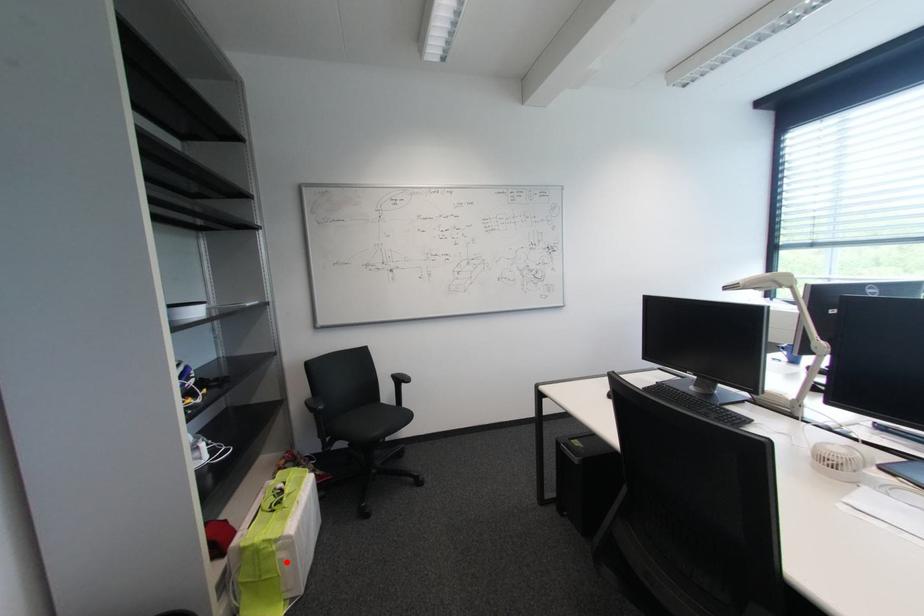
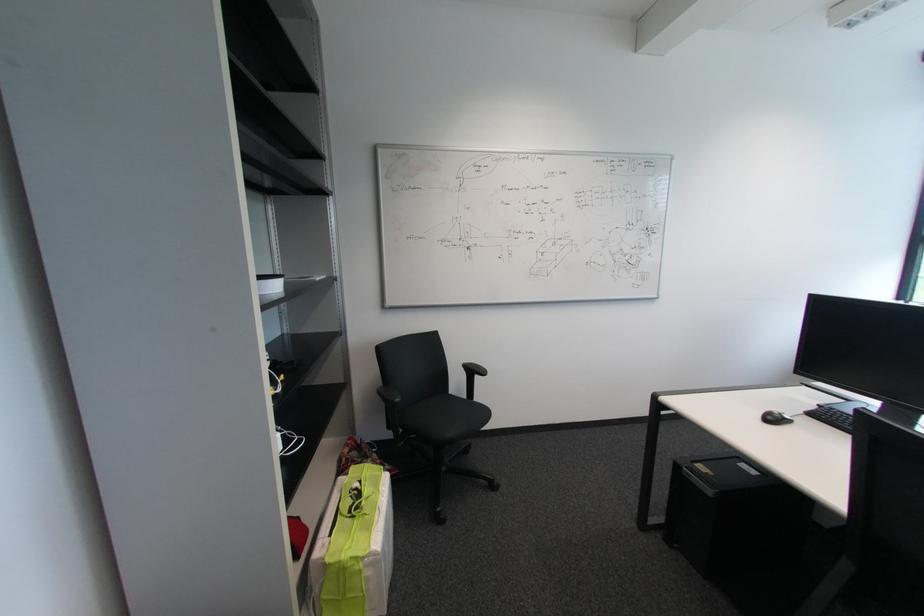
In the second image, find the point that corresponds to the highlighted location in the first image.

(372, 581)